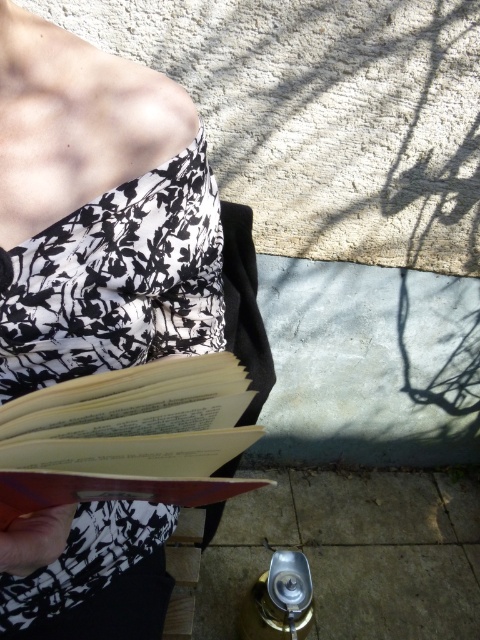
Can you confirm if black floral fabric dress at center is smaller than light brown paper book at center?

No.

Describe the element at coordinates (118, 280) in the screenshot. The height and width of the screenshot is (640, 480). I see `black floral fabric dress at center` at that location.

Is point (58, 224) behind point (16, 508)?

Yes, point (58, 224) is farther from viewer.

Locate an element on the screen. The height and width of the screenshot is (640, 480). black floral fabric dress at center is located at coordinates (118, 280).